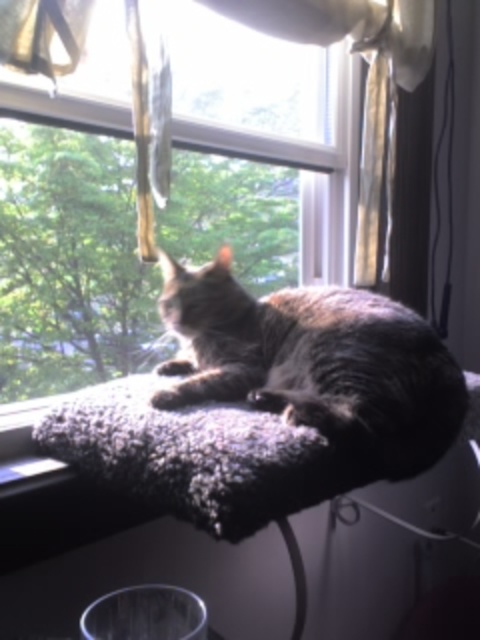
You are a photographer setting up a shot of the gray fur cat at center and the fuzzy fabric cat bed at upper center. To ensure both are in frame, where should you position your camera relative to the cat bed?

Position the camera to the left of the fuzzy fabric cat bed at upper center so that the gray fur cat at center, which is to the right of the cat bed, stays within the frame along with the bed.

From the picture: You are a cat owner who wants to ensure your gray fur cat at center has a comfortable spot on the windowsill. Since the fuzzy fabric cat bed at upper center is underneath the cat, does this mean the bed is still accessible for the cat to move onto?

The gray fur cat at center is positioned over the fuzzy fabric cat bed at upper center, which means the bed is currently under the cat and may not be easily accessible for the cat to move onto without shifting its position.